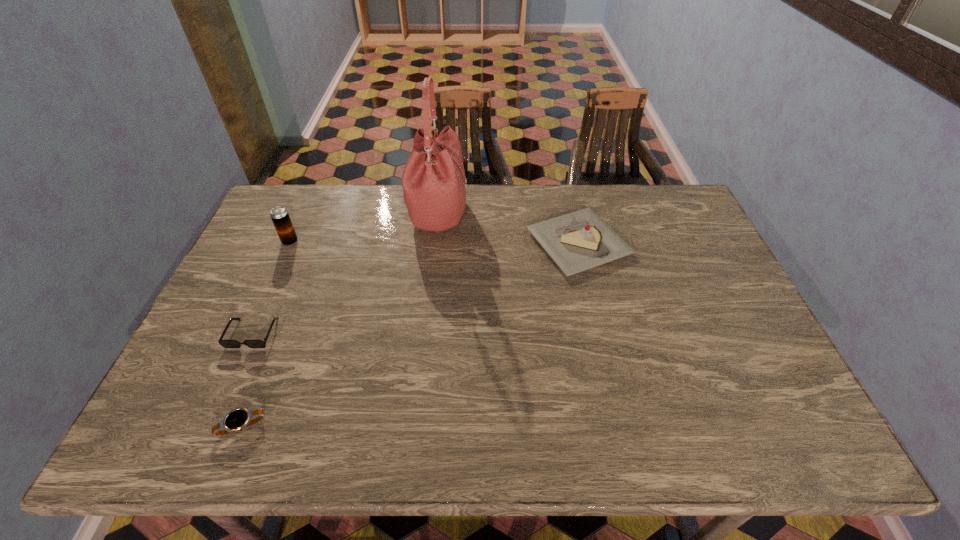
Locate an element on the screen. Image resolution: width=960 pixels, height=540 pixels. vacant space at the near edge of the desktop is located at coordinates (359, 442).

Where is `free region at the left edge of the desktop`? Image resolution: width=960 pixels, height=540 pixels. free region at the left edge of the desktop is located at coordinates (277, 276).

In the image, there is a desktop. Find the location of `free space at the right edge`. free space at the right edge is located at coordinates (690, 246).

In the image, there is a desktop. At what (x,y) coordinates should I click in order to perform the action: click on free region at the far left corner. Please return your answer as a coordinate pair (x, y). Looking at the image, I should click on (308, 224).

In the image, there is a desktop. Where is `vacant space at the far right corner`? This screenshot has width=960, height=540. vacant space at the far right corner is located at coordinates 645,192.

Locate an element on the screen. This screenshot has height=540, width=960. empty space that is in between the cake and the watch is located at coordinates (411, 335).

Image resolution: width=960 pixels, height=540 pixels. In order to click on empty space that is in between the second object from right to left and the watch in this screenshot , I will do `click(341, 319)`.

Where is `vacant area between the rightmost object and the fourth shortest object`? vacant area between the rightmost object and the fourth shortest object is located at coordinates [434, 242].

Where is `blank region between the sunglasses and the beer can`? blank region between the sunglasses and the beer can is located at coordinates (272, 287).

You are a GUI agent. You are given a task and a screenshot of the screen. Output one action in this format:
    pyautogui.click(x=<x>, y=<y>)
    Task: Click on the free space that is in between the fourth shortest object and the handbag
    
    Given the screenshot: What is the action you would take?
    pyautogui.click(x=365, y=227)